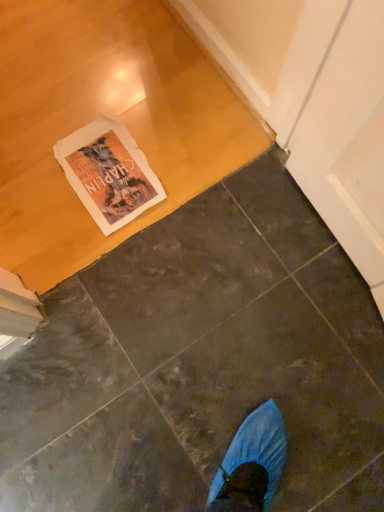
Describe the element at coordinates (108, 173) in the screenshot. I see `white paper magazine at upper left` at that location.

Identify the location of white paper magazine at upper left. (108, 173).

Locate an element on the screen. white paper magazine at upper left is located at coordinates (108, 173).